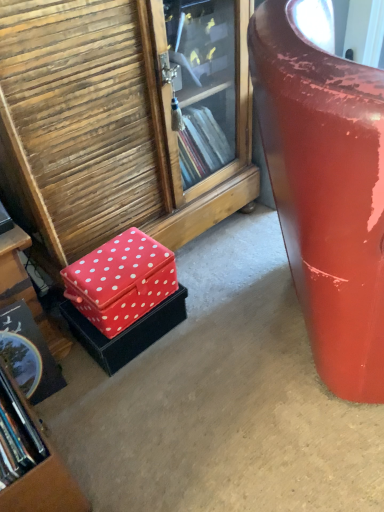
Question: From the image's perspective, is glossy red suitcase at right on top of red fabric box at lower left, the 2th box in the bottom-to-top sequence?

Choices:
 (A) no
 (B) yes

Answer: (B)

Question: Is red fabric box at lower left, placed as the first box when sorted from top to bottom, surrounded by glossy red suitcase at right?

Choices:
 (A) no
 (B) yes

Answer: (A)

Question: Does glossy red suitcase at right turn towards red fabric box at lower left, placed as the first box when sorted from top to bottom?

Choices:
 (A) no
 (B) yes

Answer: (A)

Question: Is glossy red suitcase at right at the left side of red fabric box at lower left, the 2th box in the bottom-to-top sequence?

Choices:
 (A) yes
 (B) no

Answer: (B)

Question: Does glossy red suitcase at right have a larger size compared to red fabric box at lower left, the 2th box in the bottom-to-top sequence?

Choices:
 (A) yes
 (B) no

Answer: (A)

Question: From the image's perspective, relative to red fabric box at lower left, the 2th box positioned from the top, is glossy red suitcase at right above or below?

Choices:
 (A) above
 (B) below

Answer: (A)

Question: Which is correct: glossy red suitcase at right is inside red fabric box at lower left, the 2th box positioned from the top, or outside of it?

Choices:
 (A) outside
 (B) inside

Answer: (A)

Question: From their relative heights in the image, would you say glossy red suitcase at right is taller or shorter than red fabric box at lower left, the 2th box positioned from the top?

Choices:
 (A) short
 (B) tall

Answer: (B)

Question: Looking at the image, does glossy red suitcase at right seem bigger or smaller compared to red fabric box at lower left, the 2th box positioned from the top?

Choices:
 (A) small
 (B) big

Answer: (B)

Question: From a real-world perspective, is red fabric box at lower left, the 2th box positioned from the top, physically located above or below red fabric box at lower left?

Choices:
 (A) above
 (B) below

Answer: (A)

Question: Visually, is red fabric box at lower left, which ranks as the first box in bottom-to-top order, positioned to the left or to the right of red fabric box at lower left?

Choices:
 (A) left
 (B) right

Answer: (A)

Question: Considering the positions of red fabric box at lower left, which ranks as the first box in bottom-to-top order, and red fabric box at lower left in the image, is red fabric box at lower left, which ranks as the first box in bottom-to-top order, wider or thinner than red fabric box at lower left?

Choices:
 (A) thin
 (B) wide

Answer: (A)

Question: Is red fabric box at lower left, which ranks as the first box in bottom-to-top order, in front of or behind red fabric box at lower left in the image?

Choices:
 (A) behind
 (B) front

Answer: (A)

Question: Do you think red fabric box at lower left is within red fabric box at lower left, the 2th box in the bottom-to-top sequence, or outside of it?

Choices:
 (A) inside
 (B) outside

Answer: (B)

Question: From a real-world perspective, is red fabric box at lower left above or below red fabric box at lower left, placed as the first box when sorted from top to bottom?

Choices:
 (A) below
 (B) above

Answer: (A)